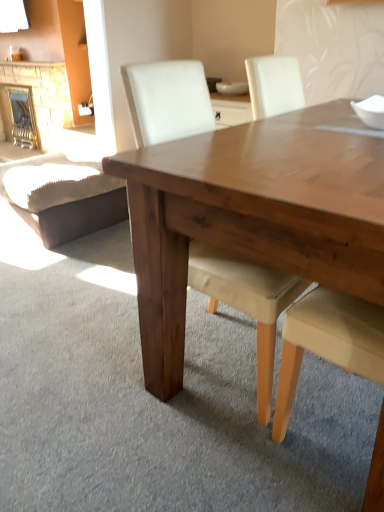
Question: Is brown leather swivel chair at lower left aimed at white glossy bowl at upper right, acting as the second bowl starting from the back?

Choices:
 (A) yes
 (B) no

Answer: (B)

Question: Is brown leather swivel chair at lower left to the right of white glossy bowl at upper right, which is counted as the first bowl, starting from the right, from the viewer's perspective?

Choices:
 (A) yes
 (B) no

Answer: (B)

Question: Can you confirm if brown leather swivel chair at lower left is bigger than white glossy bowl at upper right, acting as the second bowl starting from the back?

Choices:
 (A) yes
 (B) no

Answer: (A)

Question: Is white glossy bowl at upper right, which ranks as the 1th bowl in front-to-back order, located within brown leather swivel chair at lower left?

Choices:
 (A) yes
 (B) no

Answer: (B)

Question: Is brown leather swivel chair at lower left at the left side of white glossy bowl at upper right, acting as the second bowl starting from the back?

Choices:
 (A) no
 (B) yes

Answer: (B)

Question: Does brown leather swivel chair at lower left have a lesser height compared to white glossy bowl at upper right, the first bowl in the bottom-to-top sequence?

Choices:
 (A) no
 (B) yes

Answer: (A)

Question: Is the depth of matte white chair at center less than that of brick fireplace at left, the second fireplace when ordered from right to left?

Choices:
 (A) yes
 (B) no

Answer: (A)

Question: Can you confirm if matte white chair at center is positioned to the right of brick fireplace at left, placed as the 1th fireplace when sorted from left to right?

Choices:
 (A) yes
 (B) no

Answer: (A)

Question: Considering the relative positions of matte white chair at center and brick fireplace at left, placed as the 1th fireplace when sorted from left to right, in the image provided, is matte white chair at center behind brick fireplace at left, placed as the 1th fireplace when sorted from left to right,?

Choices:
 (A) no
 (B) yes

Answer: (A)

Question: Does matte white chair at center have a lesser height compared to brick fireplace at left, placed as the 1th fireplace when sorted from left to right?

Choices:
 (A) no
 (B) yes

Answer: (A)

Question: From the image's perspective, would you say matte white chair at center is shown under brick fireplace at left, placed as the 1th fireplace when sorted from left to right?

Choices:
 (A) no
 (B) yes

Answer: (B)

Question: Is matte white chair at center to the left of brick fireplace at left, the second fireplace when ordered from right to left, from the viewer's perspective?

Choices:
 (A) yes
 (B) no

Answer: (B)

Question: From the image's perspective, would you say white glossy bowl at upper right, acting as the second bowl starting from the back, is positioned over brick fireplace at left, the 1th fireplace from the right?

Choices:
 (A) yes
 (B) no

Answer: (B)